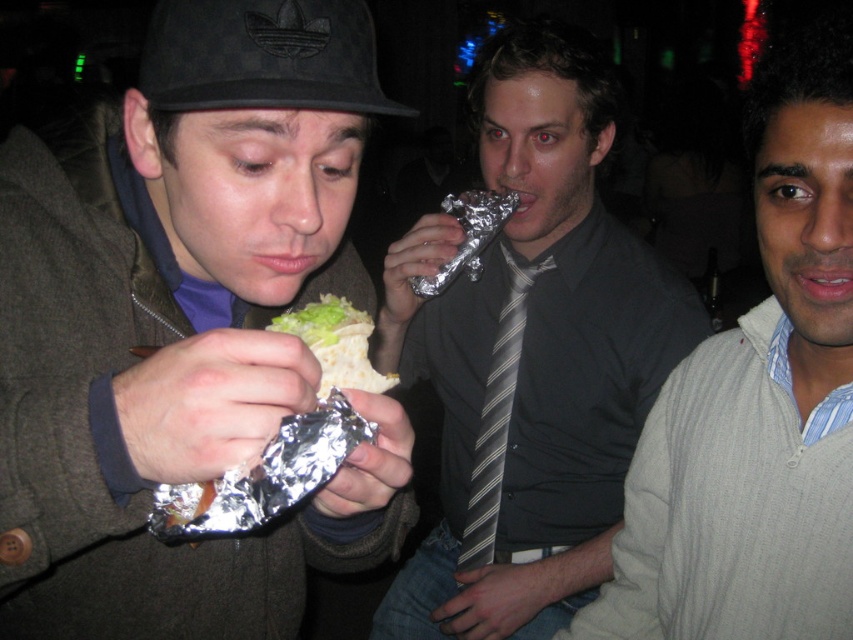
Question: Which of the following is the farthest from the observer?

Choices:
 (A) (500, 486)
 (B) (827, 32)
 (C) (215, 65)
 (D) (523, 529)

Answer: (D)

Question: Does striped tie at center appear on the left side of gray ribbed sweater at right?

Choices:
 (A) yes
 (B) no

Answer: (A)

Question: Considering the real-world distances, which object is closest to the matte black hat at upper left?

Choices:
 (A) green leafy lettuce at center
 (B) black suede baseball cap at upper left
 (C) gray ribbed sweater at right

Answer: (B)

Question: Can you confirm if gray ribbed sweater at right is positioned above green leafy lettuce at center?

Choices:
 (A) yes
 (B) no

Answer: (B)

Question: Which object appears closest to the camera in this image?

Choices:
 (A) matte black hat at upper left
 (B) striped tie at center
 (C) striped fabric tie at center
 (D) gray ribbed sweater at right

Answer: (A)

Question: Can you confirm if striped tie at center is positioned to the left of gray ribbed sweater at right?

Choices:
 (A) yes
 (B) no

Answer: (A)